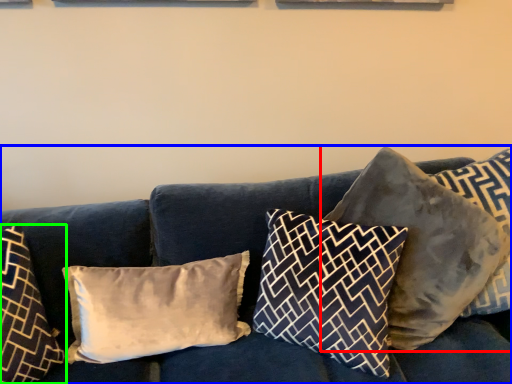
Question: Which object is the farthest from pillow (highlighted by a red box)? Choose among these: studio couch (highlighted by a blue box) or pillow (highlighted by a green box).

Choices:
 (A) studio couch
 (B) pillow

Answer: (B)